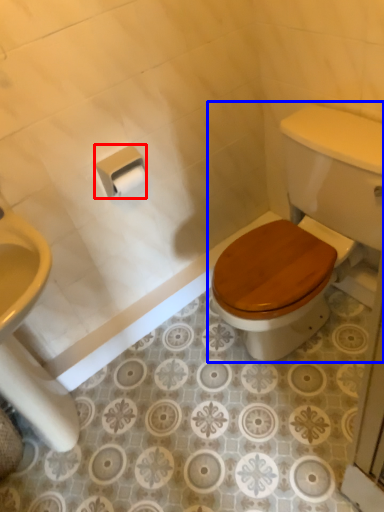
Question: Which object is closer to the camera taking this photo, toilet paper (highlighted by a red box) or toilet (highlighted by a blue box)?

Choices:
 (A) toilet paper
 (B) toilet

Answer: (B)